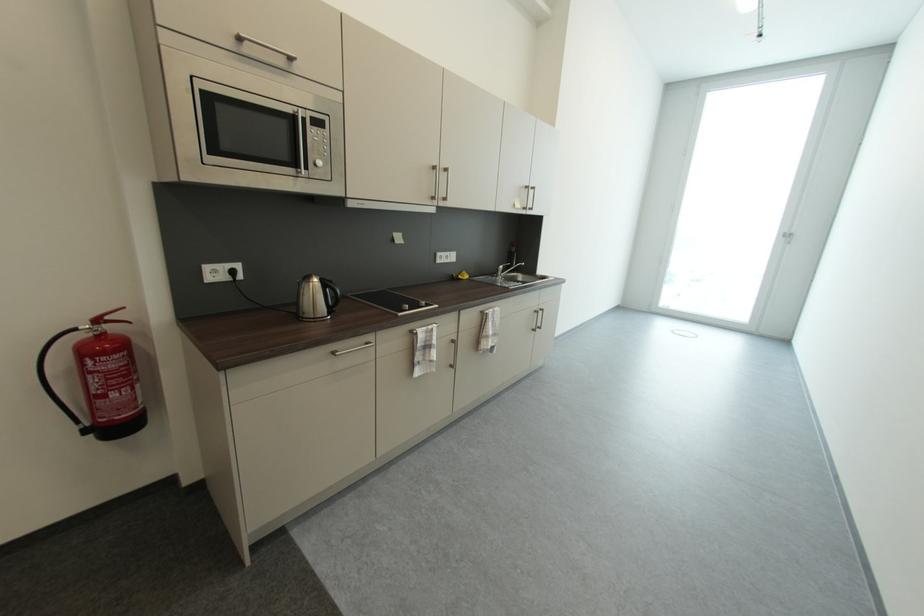
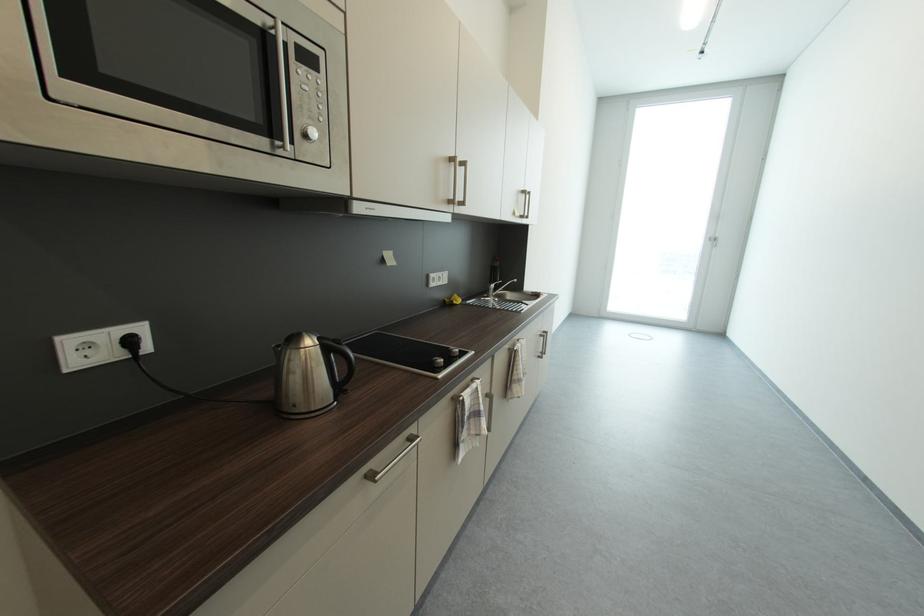
What movement of the cameraman would produce the second image?

The movement direction of the cameraman is left, forward.